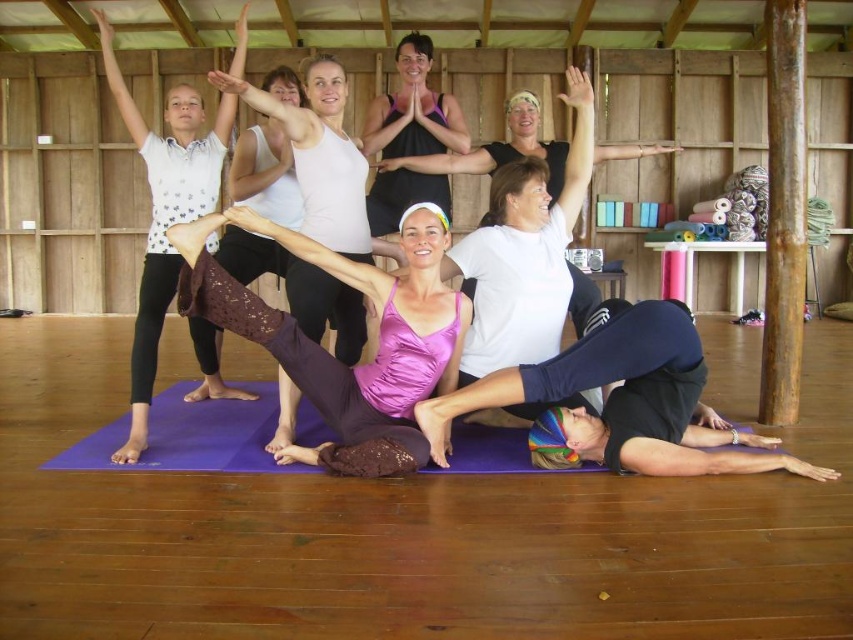
Question: Can you confirm if white dotted tank top at upper left is bigger than purple lace leggings at center?

Choices:
 (A) no
 (B) yes

Answer: (B)

Question: Is white dotted tank top at upper left in front of purple lace leggings at center?

Choices:
 (A) yes
 (B) no

Answer: (B)

Question: Which of the following is the closest to the observer?

Choices:
 (A) (178, 216)
 (B) (351, 154)

Answer: (B)

Question: Is white dotted tank top at upper left to the left of purple lace leggings at center from the viewer's perspective?

Choices:
 (A) no
 (B) yes

Answer: (B)